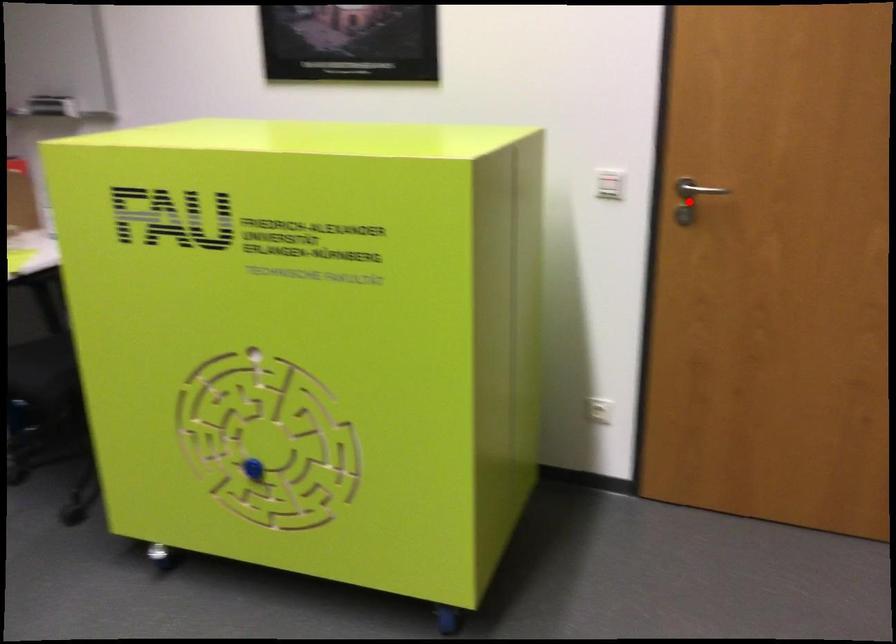
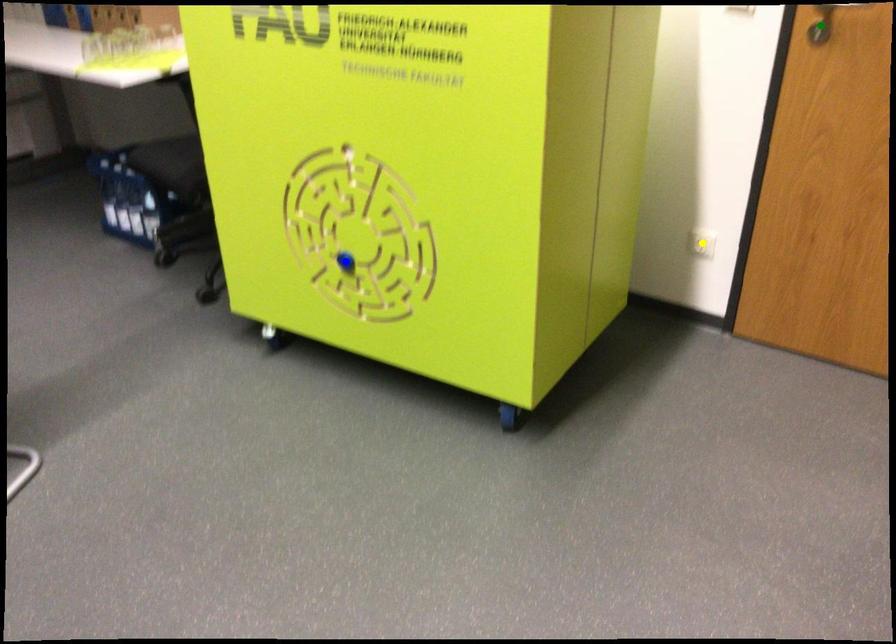
Question: I am providing you with two images of the same scene from different viewpoints. A red point is marked on the first image. You are given multiple points on the second image. Which point in image 2 is actually the same real-world point as the red point in image 1?

Choices:
 (A) green point
 (B) yellow point
 (C) blue point

Answer: (A)